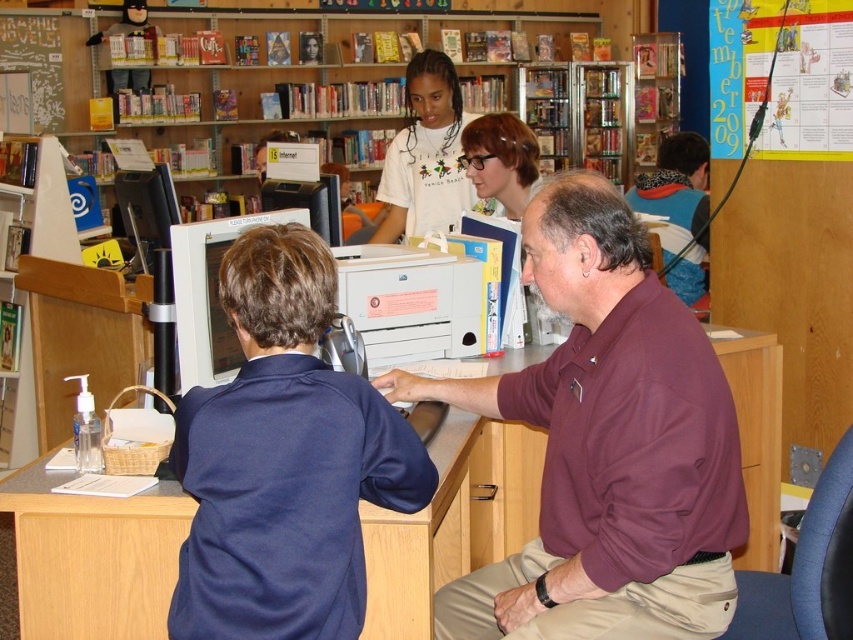
You are a visitor in the library and want to sit at the wooden desk at center. However, there is a white cotton shirt at center in your way. Can you reach the desk without moving the shirt?

The wooden desk at center is positioned under the white cotton shirt at center, so you can reach the desk without needing to move the shirt as it is located beneath it.